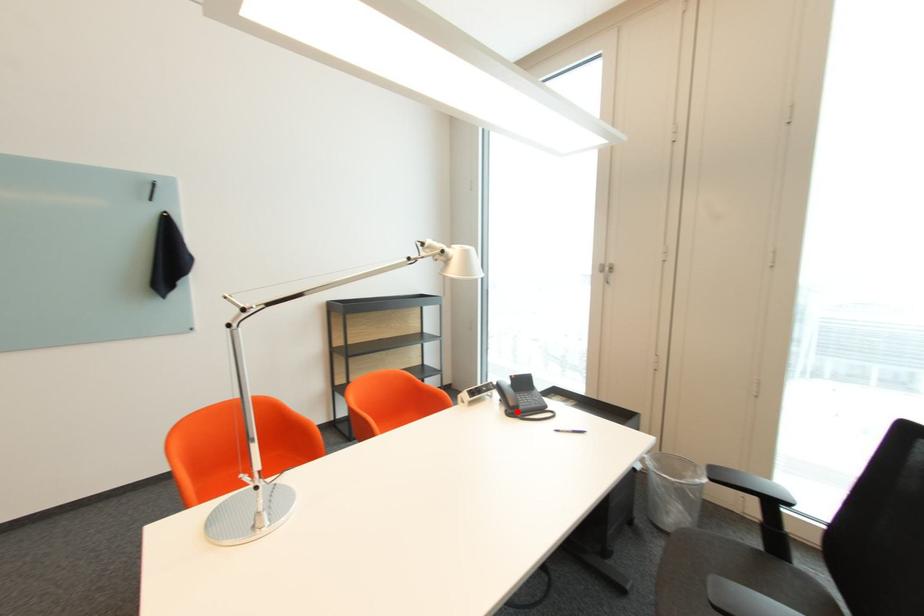
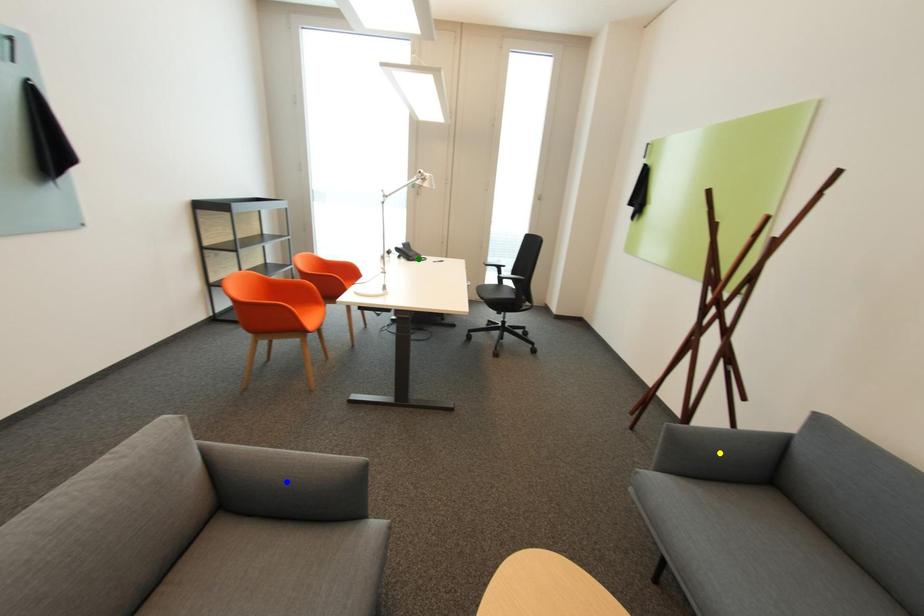
Question: I am providing you with two images of the same scene from different viewpoints. A red point is marked on the first image. You are given multiple points on the second image. Can you choose the point in image 2 that corresponds to the point in image 1?

Choices:
 (A) green point
 (B) blue point
 (C) yellow point

Answer: (A)